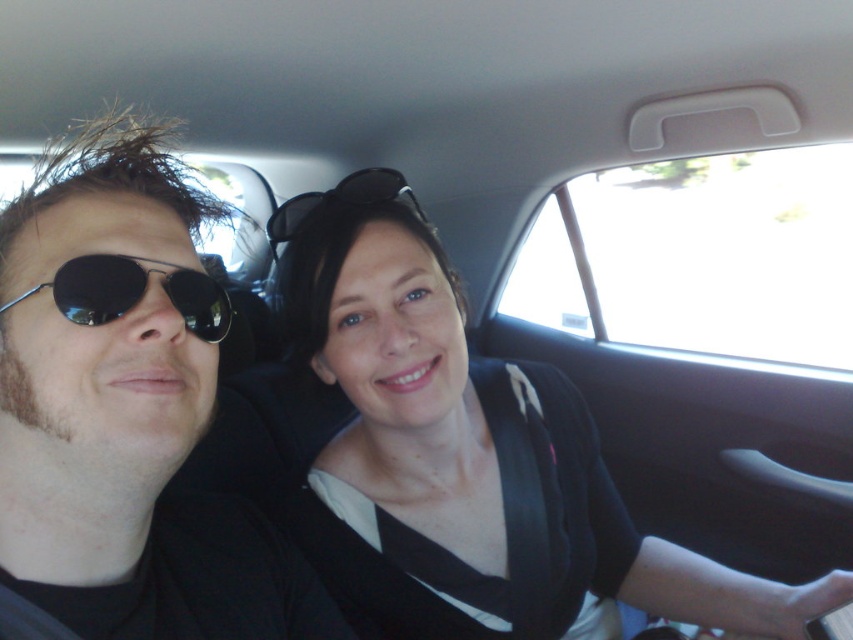
Question: Which point is closer to the camera taking this photo?

Choices:
 (A) (160, 316)
 (B) (93, 308)

Answer: (A)

Question: Among these points, which one is farthest from the camera?

Choices:
 (A) (289, 204)
 (B) (213, 310)

Answer: (A)

Question: Which point is farther to the camera?

Choices:
 (A) (59, 300)
 (B) (381, 170)

Answer: (B)

Question: Can you confirm if black reflective sunglasses at left is positioned to the right of matte black sunglasses at center?

Choices:
 (A) yes
 (B) no

Answer: (B)

Question: Does matte black sunglasses at left appear under black reflective sunglasses at left?

Choices:
 (A) no
 (B) yes

Answer: (B)

Question: Does matte black sunglasses at left appear on the right side of matte black sunglasses at center?

Choices:
 (A) no
 (B) yes

Answer: (A)